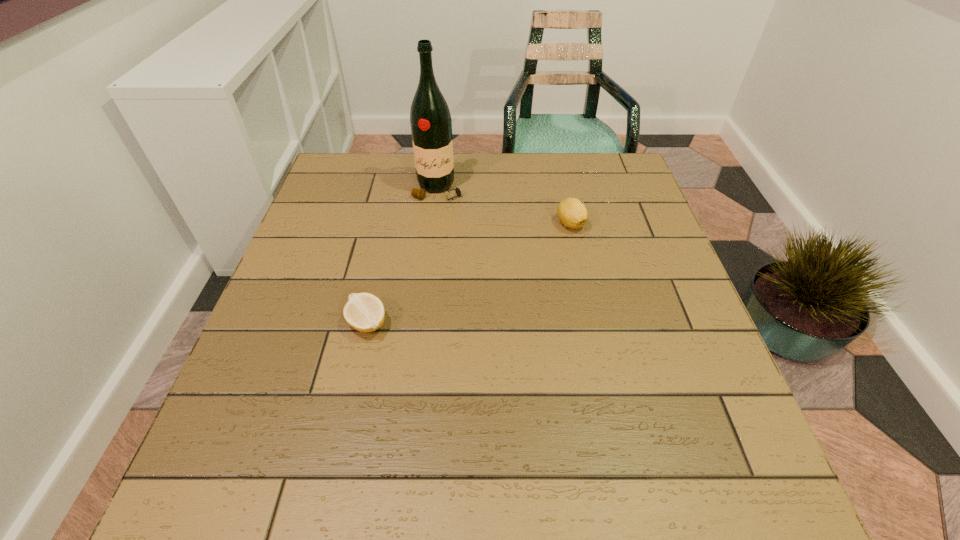
Where is `vacant region between the nearest object and the farthest object`? The height and width of the screenshot is (540, 960). vacant region between the nearest object and the farthest object is located at coordinates (402, 256).

Find the location of a particular element. The width and height of the screenshot is (960, 540). empty space between the nearest object and the farthest object is located at coordinates (402, 256).

Locate an element on the screen. The height and width of the screenshot is (540, 960). vacant space that's between the nearest object and the rightmost object is located at coordinates (468, 273).

Locate an element on the screen. vacant area between the wine bottle and the second shortest object is located at coordinates (504, 206).

Find the location of a particular element. This screenshot has height=540, width=960. free space that is in between the second object from left to right and the rightmost object is located at coordinates (504, 206).

Locate an element on the screen. The height and width of the screenshot is (540, 960). free space between the rightmost object and the nearest object is located at coordinates (468, 273).

Image resolution: width=960 pixels, height=540 pixels. In order to click on object that is the closest one to the nearer lemon in this screenshot , I will do `click(431, 126)`.

What are the coordinates of `object identified as the closest to the shorter lemon` in the screenshot? It's located at (431, 126).